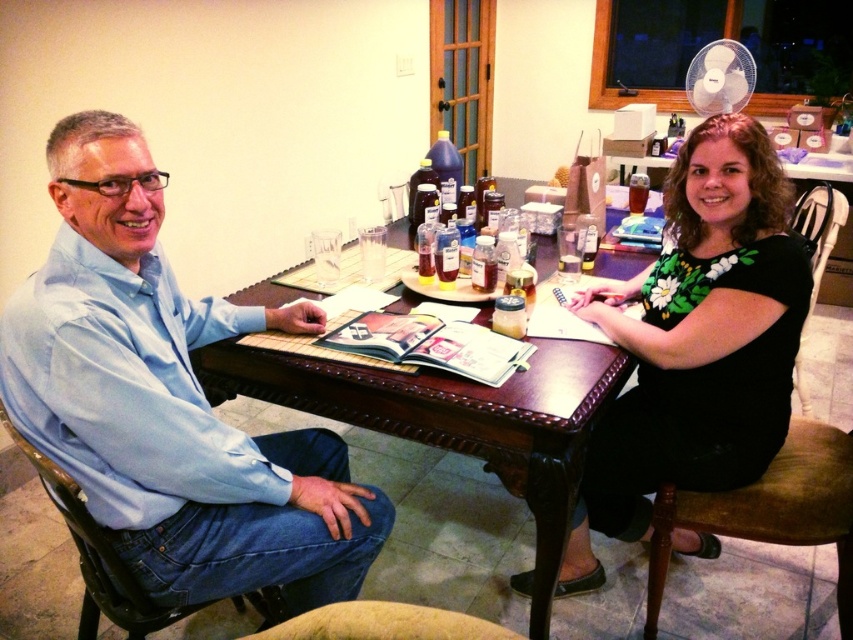
Based on the coordinates provided, which object in the scene corresponds to the point labeled as point (x=456, y=420)?

The point (x=456, y=420) corresponds to the brown wooden table at center.

You are standing in the room where the brown wooden table at center is located. If you face the table and look directly at its center, what are the coordinates of the table?

The coordinates of the brown wooden table at center are at point (456, 420).